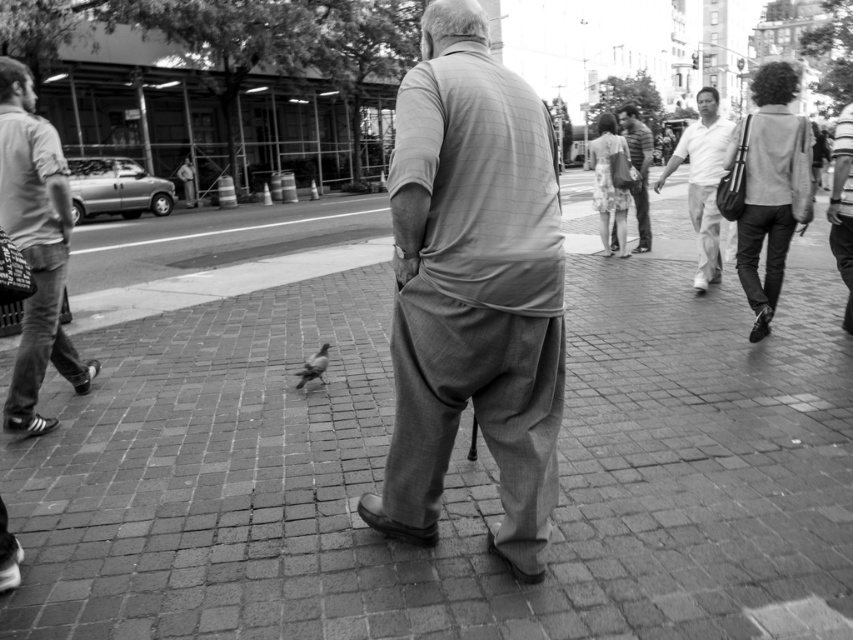
In the black and white street scene, there is a man wearing a white cotton shirt at upper right and another person wearing a striped cotton shirt at center. From the perspective of someone standing at the center of the image, which shirt is positioned to the right?

The white cotton shirt at upper right is to the right of the striped cotton shirt at center, so from the center of the image, the white cotton shirt at upper right is positioned to the right.